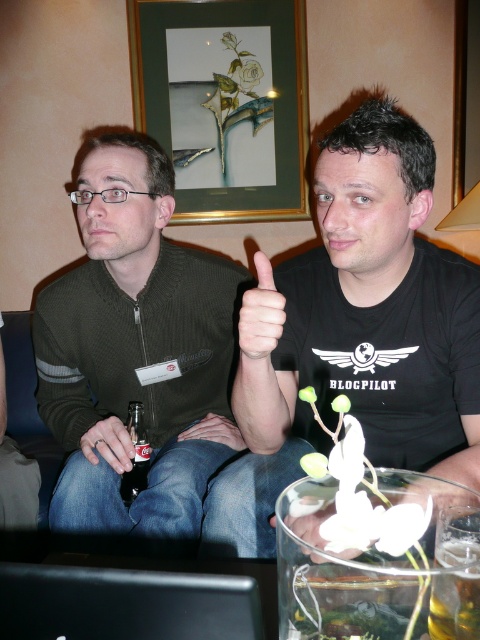
Question: Estimate the real-world distances between objects in this image. Which object is farther from the black matte shirt at center?

Choices:
 (A) dark glass bottle at lower left
 (B) gold-framed picture at upper center
 (C) black matte laptop at lower center

Answer: (B)

Question: Considering the real-world distances, which object is farthest from the black matte laptop at lower center?

Choices:
 (A) dark glass bottle at lower left
 (B) black matte shirt at center

Answer: (A)

Question: Where is dark green sweater at center located in relation to dark glass bottle at lower left in the image?

Choices:
 (A) above
 (B) below

Answer: (A)

Question: Among these objects, which one is nearest to the camera?

Choices:
 (A) dark glass bottle at lower left
 (B) black matte shirt at center
 (C) clear glass bottle at lower center

Answer: (C)

Question: Does black matte laptop at lower center have a greater width compared to dark glass bottle at lower left?

Choices:
 (A) yes
 (B) no

Answer: (A)

Question: Is gold-framed picture at upper center wider than black matte laptop at lower center?

Choices:
 (A) no
 (B) yes

Answer: (B)